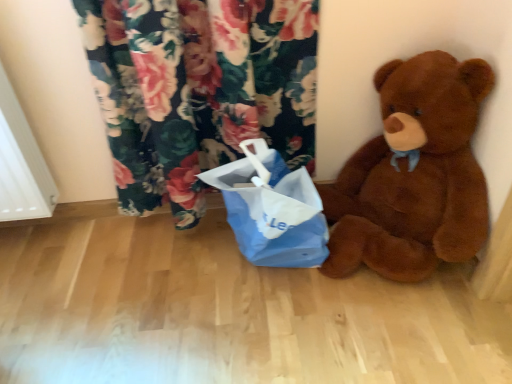
Question: Relative to brown plush teddy bear at right, is blue paper bag at center in front or behind?

Choices:
 (A) front
 (B) behind

Answer: (B)

Question: Is blue paper bag at center situated inside brown plush teddy bear at right or outside?

Choices:
 (A) outside
 (B) inside

Answer: (A)

Question: Looking at the image, does blue paper bag at center seem bigger or smaller compared to brown plush teddy bear at right?

Choices:
 (A) big
 (B) small

Answer: (B)

Question: Based on their positions, is brown plush teddy bear at right located to the left or right of blue paper bag at center?

Choices:
 (A) right
 (B) left

Answer: (A)

Question: From a real-world perspective, is brown plush teddy bear at right above or below blue paper bag at center?

Choices:
 (A) above
 (B) below

Answer: (A)

Question: Considering the positions of brown plush teddy bear at right and blue paper bag at center in the image, is brown plush teddy bear at right wider or thinner than blue paper bag at center?

Choices:
 (A) wide
 (B) thin

Answer: (A)

Question: Relative to blue paper bag at center, is brown plush teddy bear at right in front or behind?

Choices:
 (A) behind
 (B) front

Answer: (B)